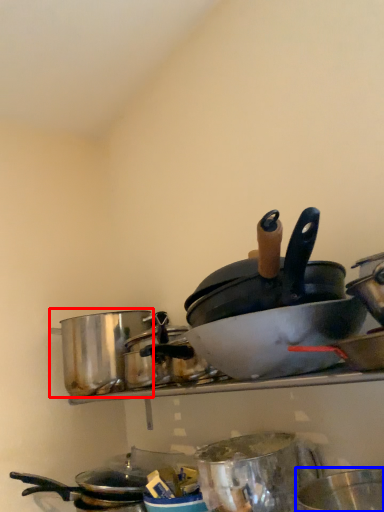
Question: Which object appears closest to the camera in this image, crock pot (highlighted by a red box) or basin (highlighted by a blue box)?

Choices:
 (A) crock pot
 (B) basin

Answer: (B)